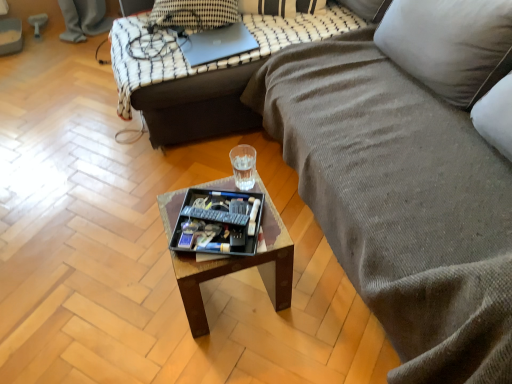
What is the approximate height of black plastic remote control at center?

The height of black plastic remote control at center is 1.59 inches.

In order to face transparent plastic glass at center, should I rotate leftwards or rightwards?

Rotate your view left by about 0.747°.

Measure the distance between sleek silver laptop at upper center and camera.

A distance of 1.97 meters exists between sleek silver laptop at upper center and camera.

Find the location of a particular element. This screenshot has width=512, height=384. sleek silver laptop at upper center is located at coordinates (217, 44).

Locate an element on the screen. black plastic remote control at center is located at coordinates (215, 216).

Is there a large distance between black plastic remote control at center and metallic gray swivel chair at upper left?

black plastic remote control at center is far away from metallic gray swivel chair at upper left.

Can you confirm if black plastic remote control at center is positioned to the left of metallic gray swivel chair at upper left?

Incorrect, black plastic remote control at center is not on the left side of metallic gray swivel chair at upper left.

From a real-world perspective, who is located lower, black plastic remote control at center or metallic gray swivel chair at upper left?

From a 3D spatial view, metallic gray swivel chair at upper left is below.

Is point (238, 224) positioned after point (39, 18)?

No, it is not.

Does wooden tray at center have a lesser height compared to transparent plastic glass at center?

No, wooden tray at center is not shorter than transparent plastic glass at center.

From a real-world perspective, is wooden tray at center beneath transparent plastic glass at center?

Yes, from a real-world perspective, wooden tray at center is beneath transparent plastic glass at center.

Is wooden tray at center inside the boundaries of transparent plastic glass at center, or outside?

wooden tray at center is spatially situated outside transparent plastic glass at center.

Locate an element on the screen. coffee cup behind the wooden tray at center is located at coordinates (243, 166).

Looking at this image, do you think transparent plastic glass at center is within textured gray fabric couch at center, which ranks as the 1th studio couch in front-to-back order, or outside of it?

transparent plastic glass at center is not enclosed by textured gray fabric couch at center, which ranks as the 1th studio couch in front-to-back order.

Is transparent plastic glass at center to the left or to the right of textured gray fabric couch at center, positioned as the 2th studio couch in back-to-front order, in the image?

In the image, transparent plastic glass at center appears on the left side of textured gray fabric couch at center, positioned as the 2th studio couch in back-to-front order.

From the image's perspective, which one is positioned lower, transparent plastic glass at center or textured gray fabric couch at center, positioned as the 2th studio couch in back-to-front order?

transparent plastic glass at center is shown below in the image.

Considering the sizes of transparent plastic glass at center and textured gray fabric couch at center, positioned as the 2th studio couch in back-to-front order, in the image, is transparent plastic glass at center wider or thinner than textured gray fabric couch at center, positioned as the 2th studio couch in back-to-front order,?

Clearly, transparent plastic glass at center has less width compared to textured gray fabric couch at center, positioned as the 2th studio couch in back-to-front order.

Between black plastic remote control at center and textured gray fabric couch at center, positioned as the 2th studio couch in back-to-front order, which one has smaller width?

With smaller width is black plastic remote control at center.

Do you think black plastic remote control at center is within textured gray fabric couch at center, positioned as the 2th studio couch in back-to-front order, or outside of it?

black plastic remote control at center lies outside textured gray fabric couch at center, positioned as the 2th studio couch in back-to-front order.

How different are the orientations of black plastic remote control at center and textured gray fabric couch at center, positioned as the 2th studio couch in back-to-front order, in degrees?

They differ by 33.9 degrees in their facing directions.

From the image's perspective, is black plastic remote control at center above or below textured gray fabric couch at center, positioned as the 2th studio couch in back-to-front order?

black plastic remote control at center is below textured gray fabric couch at center, positioned as the 2th studio couch in back-to-front order.

Considering the sizes of objects transparent plastic glass at center and sleek silver laptop at upper center in the image provided, who is shorter, transparent plastic glass at center or sleek silver laptop at upper center?

sleek silver laptop at upper center.

From a real-world perspective, relative to sleek silver laptop at upper center, is transparent plastic glass at center vertically above or below?

transparent plastic glass at center is below sleek silver laptop at upper center.

Is transparent plastic glass at center not near sleek silver laptop at upper center?

transparent plastic glass at center is near sleek silver laptop at upper center, not far away.

Does transparent plastic glass at center have a lesser width compared to sleek silver laptop at upper center?

Indeed, transparent plastic glass at center has a lesser width compared to sleek silver laptop at upper center.

From the image's perspective, is transparent plastic glass at center located above or below metallic silver laptop at upper center, the 2th studio couch in the front-to-back sequence?

Based on their image positions, transparent plastic glass at center is located beneath metallic silver laptop at upper center, the 2th studio couch in the front-to-back sequence.

Could metallic silver laptop at upper center, the 2th studio couch in the front-to-back sequence, be considered to be inside transparent plastic glass at center?

That's incorrect, metallic silver laptop at upper center, the 2th studio couch in the front-to-back sequence, is not inside transparent plastic glass at center.

Is transparent plastic glass at center behind metallic silver laptop at upper center, acting as the first studio couch starting from the back?

That is False.

Is point (270, 203) closer or farther from the camera than point (42, 24)?

Point (270, 203).

Is wooden tray at center oriented towards metallic gray swivel chair at upper left?

No, wooden tray at center is not facing towards metallic gray swivel chair at upper left.

How many degrees apart are the facing directions of wooden tray at center and metallic gray swivel chair at upper left?

The facing directions of wooden tray at center and metallic gray swivel chair at upper left are 86.4 degrees apart.

The width and height of the screenshot is (512, 384). Find the location of `swivel chair that appears behind the black plastic remote control at center`. swivel chair that appears behind the black plastic remote control at center is located at coordinates (38, 22).

Identify the location of coffee table that is in front of the transparent plastic glass at center. (240, 268).

Based on their spatial positions, is sleek silver laptop at upper center or transparent plastic glass at center further from metallic silver laptop at upper center, acting as the first studio couch starting from the back?

The object further to metallic silver laptop at upper center, acting as the first studio couch starting from the back, is transparent plastic glass at center.

When comparing their distances from wooden tray at center, does sleek silver laptop at upper center or metallic silver laptop at upper center, the 2th studio couch in the front-to-back sequence, seem further?

sleek silver laptop at upper center.

Looking at the image, which one is located closer to black plastic tray at center, metallic silver laptop at upper center, the 2th studio couch in the front-to-back sequence, or metallic gray swivel chair at upper left?

metallic silver laptop at upper center, the 2th studio couch in the front-to-back sequence, is positioned closer to the anchor black plastic tray at center.

Based on their spatial positions, is black plastic remote control at center or black plastic tray at center further from transparent plastic glass at center?

Based on the image, black plastic remote control at center appears to be further to transparent plastic glass at center.

Estimate the real-world distances between objects in this image. Which object is further from metallic silver laptop at upper center, the 2th studio couch in the front-to-back sequence, sleek silver laptop at upper center or metallic gray swivel chair at upper left?

The object further to metallic silver laptop at upper center, the 2th studio couch in the front-to-back sequence, is metallic gray swivel chair at upper left.

Which object lies nearer to the anchor point metallic silver laptop at upper center, the 2th studio couch in the front-to-back sequence, transparent plastic glass at center or metallic gray swivel chair at upper left?

transparent plastic glass at center is closer to metallic silver laptop at upper center, the 2th studio couch in the front-to-back sequence.

Which object lies nearer to the anchor point black plastic remote control at center, textured gray fabric couch at center, which ranks as the 1th studio couch in front-to-back order, or metallic silver laptop at upper center, the 2th studio couch in the front-to-back sequence?

textured gray fabric couch at center, which ranks as the 1th studio couch in front-to-back order.

When comparing their distances from wooden tray at center, does sleek silver laptop at upper center or black plastic remote control at center seem further?

sleek silver laptop at upper center lies further to wooden tray at center than the other object.

Locate an element on the screen. The width and height of the screenshot is (512, 384). laptop located between wooden tray at center and metallic gray swivel chair at upper left in the depth direction is located at coordinates (217, 44).

This screenshot has height=384, width=512. I want to click on laptop between textured gray fabric couch at center, which ranks as the 1th studio couch in front-to-back order, and metallic gray swivel chair at upper left, along the z-axis, so click(x=217, y=44).

Where is `remote control located between textured gray fabric couch at center, positioned as the 2th studio couch in back-to-front order, and metallic silver laptop at upper center, acting as the first studio couch starting from the back, in the depth direction`? The height and width of the screenshot is (384, 512). remote control located between textured gray fabric couch at center, positioned as the 2th studio couch in back-to-front order, and metallic silver laptop at upper center, acting as the first studio couch starting from the back, in the depth direction is located at coordinates (x=215, y=216).

This screenshot has width=512, height=384. I want to click on coffee table between textured gray fabric couch at center, which ranks as the 1th studio couch in front-to-back order, and sleek silver laptop at upper center in the front-back direction, so click(240, 268).